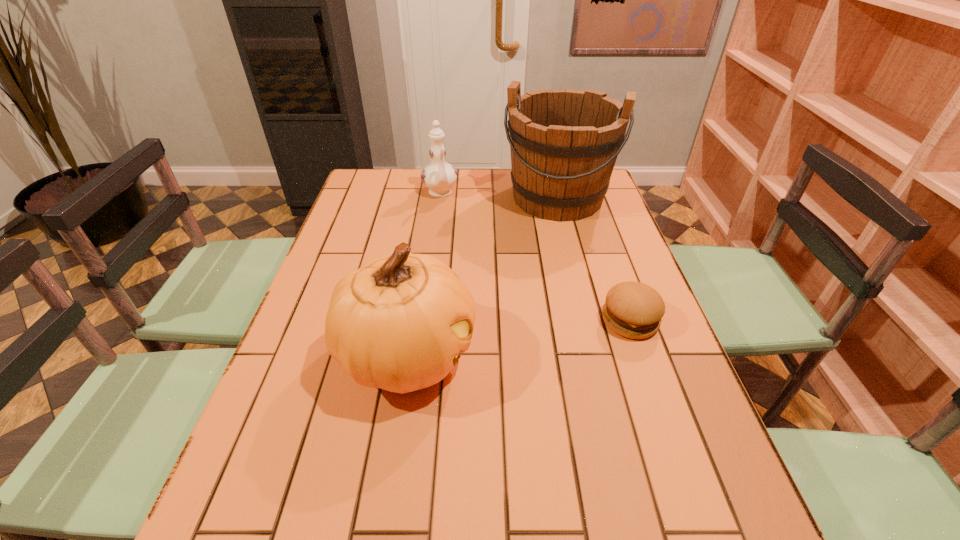
At what (x,y) coordinates should I click in order to perform the action: click on vacant space situated 0.250m on the side of the tallest object with the handle for carrying. Please return your answer as a coordinate pair (x, y). Image resolution: width=960 pixels, height=540 pixels. Looking at the image, I should click on (531, 275).

Identify the location of vacant space situated on the side of the tallest object with the handle for carrying. This screenshot has width=960, height=540. (543, 235).

Identify the location of chinaware that is at the far edge. This screenshot has height=540, width=960. (439, 176).

Where is `wine bucket that is at the far edge`? This screenshot has height=540, width=960. wine bucket that is at the far edge is located at coordinates (564, 143).

Identify the location of object that is positioned at the left edge. The image size is (960, 540). (398, 323).

In order to click on hamburger present at the right edge in this screenshot , I will do `click(632, 309)`.

This screenshot has width=960, height=540. What are the coordinates of `wine bucket at the right edge` in the screenshot? It's located at (564, 143).

The width and height of the screenshot is (960, 540). What are the coordinates of `object located in the far right corner section of the desktop` in the screenshot? It's located at click(x=564, y=143).

Find the location of a particular element. free space at the far edge is located at coordinates [431, 201].

Image resolution: width=960 pixels, height=540 pixels. In the image, there is a desktop. Identify the location of vacant space at the near edge. (580, 453).